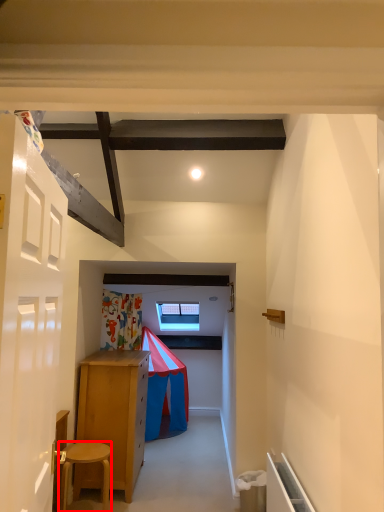
Question: From the image's perspective, where is stool (annotated by the red box) located in relation to door in the image?

Choices:
 (A) above
 (B) below

Answer: (B)